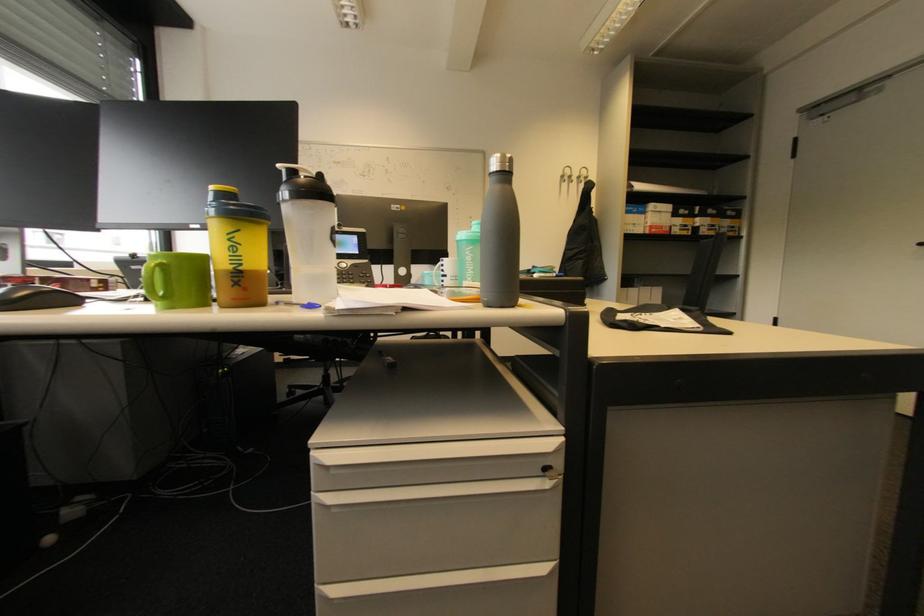
The height and width of the screenshot is (616, 924). Find the location of `silver bottle cap`. silver bottle cap is located at coordinates (500, 163).